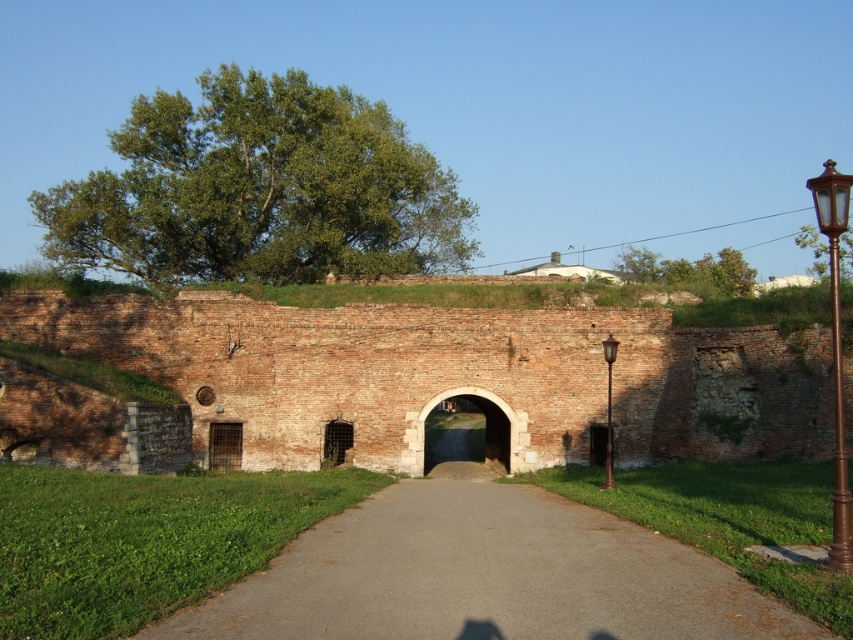
Which is in front, point (193, 296) or point (834, 204)?

Point (834, 204) is in front.

Is brown brick wall at center wider than brown polished metal lamp post at right?

No, brown brick wall at center is not wider than brown polished metal lamp post at right.

Which is in front, point (647, 416) or point (820, 182)?

Point (820, 182) is more forward.

Identify the location of brown brick wall at center. (450, 378).

Does smooth stone archway at center have a lesser height compared to bronze/golden lamppost at right?

Indeed, smooth stone archway at center has a lesser height compared to bronze/golden lamppost at right.

Is smooth stone archway at center in front of bronze/golden lamppost at right?

No, it is behind bronze/golden lamppost at right.

Which is in front, point (422, 417) or point (602, 340)?

Point (422, 417)

Find the location of `smooth stone archway at center`. smooth stone archway at center is located at coordinates (485, 428).

Find the location of a particular element. This screenshot has height=640, width=853. brown brick wall at center is located at coordinates (450, 378).

Between brown brick wall at center and bronze/golden lamppost at right, which one has less height?

bronze/golden lamppost at right

Locate an element on the screen. brown brick wall at center is located at coordinates (450, 378).

Locate an element on the screen. Image resolution: width=853 pixels, height=640 pixels. brown brick wall at center is located at coordinates (450, 378).